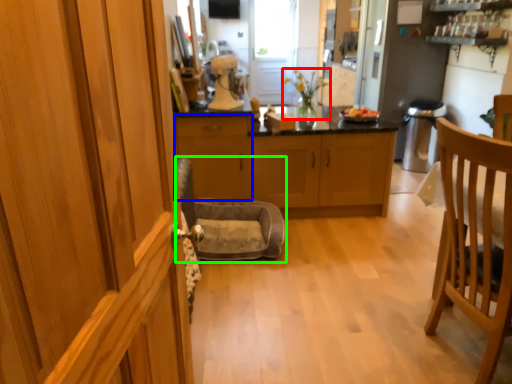
Question: Considering the real-world distances, which object is closest to houseplant (highlighted by a red box)? cabinetry (highlighted by a blue box) or rocking chair (highlighted by a green box).

Choices:
 (A) cabinetry
 (B) rocking chair

Answer: (A)